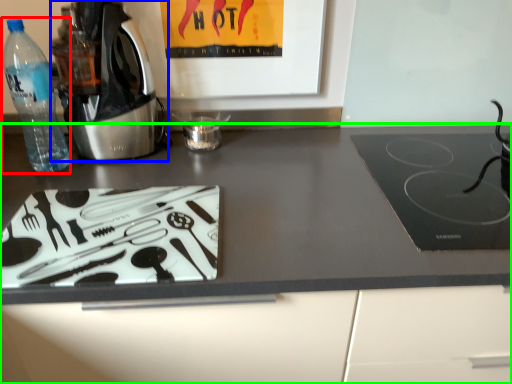
Question: Based on their relative distances, which object is nearer to bottle (highlighted by a red box)? Choose from home appliance (highlighted by a blue box) and countertop (highlighted by a green box).

Choices:
 (A) home appliance
 (B) countertop

Answer: (A)